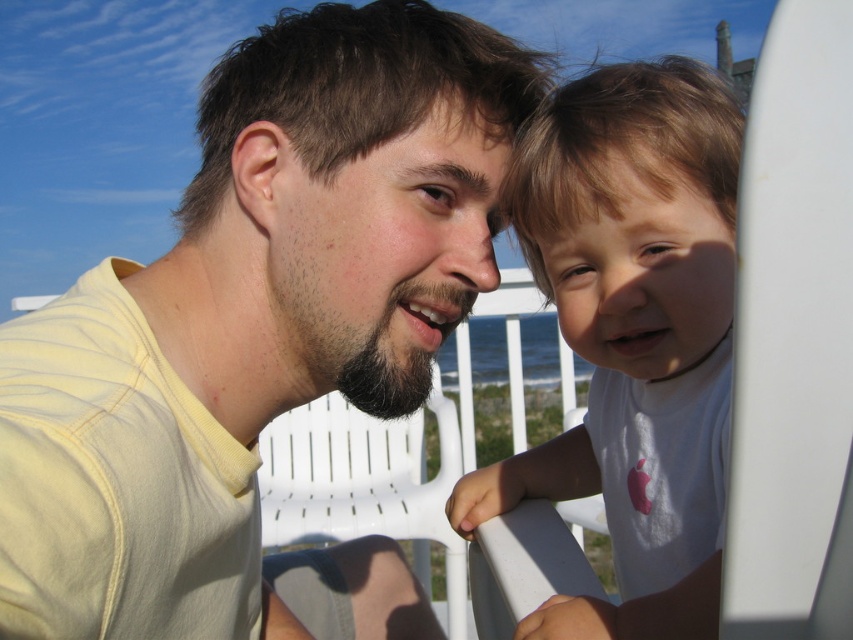
Can you confirm if yellow matte shirt at upper left is shorter than white cotton shirt at right?

No.

Between point (412, 628) and point (714, 436), which one is positioned behind?

Point (412, 628)

Locate an element on the screen. The image size is (853, 640). yellow matte shirt at upper left is located at coordinates click(x=259, y=333).

Locate an element on the screen. yellow matte shirt at upper left is located at coordinates (259, 333).